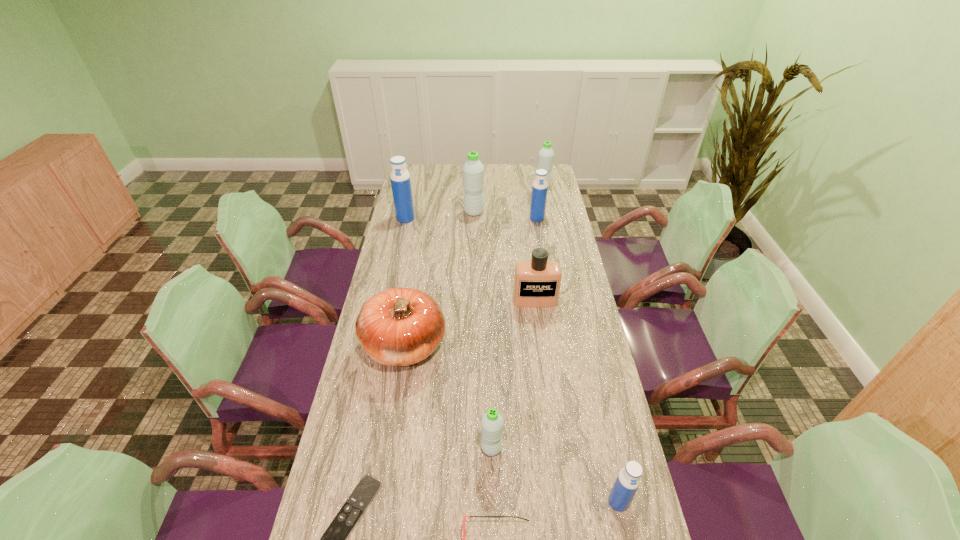
Find the location of a particular element. The image size is (960, 540). the biggest green water bottle is located at coordinates (473, 171).

The image size is (960, 540). In order to click on the leftmost blue water bottle in this screenshot , I will do `click(400, 178)`.

What are the coordinates of `the leftmost water bottle` in the screenshot? It's located at (400, 178).

Identify the location of the farthest green water bottle. The width and height of the screenshot is (960, 540). (546, 155).

I want to click on the farthest object, so click(546, 155).

I want to click on the second smallest blue water bottle, so click(x=540, y=186).

Find the location of `beige perfume`. beige perfume is located at coordinates (537, 282).

You are a GUI agent. You are given a task and a screenshot of the screen. Output one action in this format:
    pyautogui.click(x=<x>, y=<y>)
    Task: Click on the fifth farthest object
    The image size is (960, 540).
    Given the screenshot: What is the action you would take?
    pyautogui.click(x=537, y=282)

You are a GUI agent. You are given a task and a screenshot of the screen. Output one action in this format:
    pyautogui.click(x=<x>, y=<y>)
    Task: Click on the pumpkin
    This screenshot has height=540, width=960.
    Given the screenshot: What is the action you would take?
    pyautogui.click(x=400, y=326)

Locate an element on the screen. The image size is (960, 540). orange pumpkin is located at coordinates (400, 326).